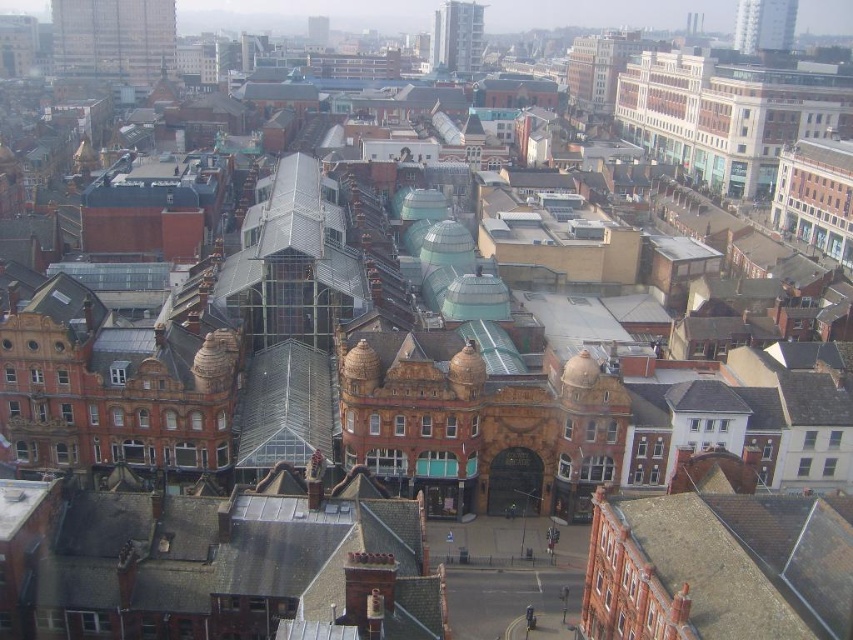
Question: Estimate the real-world distances between objects in this image. Which object is closer to the smooth glass tower at upper center?

Choices:
 (A) smooth glass skyscraper at upper right
 (B) metallic glass tower at upper left
 (C) white glass building at upper center

Answer: (C)

Question: Among these points, which one is farthest from the camera?

Choices:
 (A) (323, 45)
 (B) (735, 48)

Answer: (A)

Question: Among these points, which one is nearest to the camera?

Choices:
 (A) (321, 29)
 (B) (761, 49)
 (C) (86, 12)

Answer: (B)

Question: From the image, what is the correct spatial relationship of metallic glass tower at upper left in relation to smooth glass tower at upper center?

Choices:
 (A) right
 (B) left

Answer: (B)

Question: Is smooth glass skyscraper at upper right closer to camera compared to smooth glass tower at upper center?

Choices:
 (A) no
 (B) yes

Answer: (B)

Question: Does white glass building at upper center appear under smooth glass skyscraper at upper right?

Choices:
 (A) no
 (B) yes

Answer: (A)